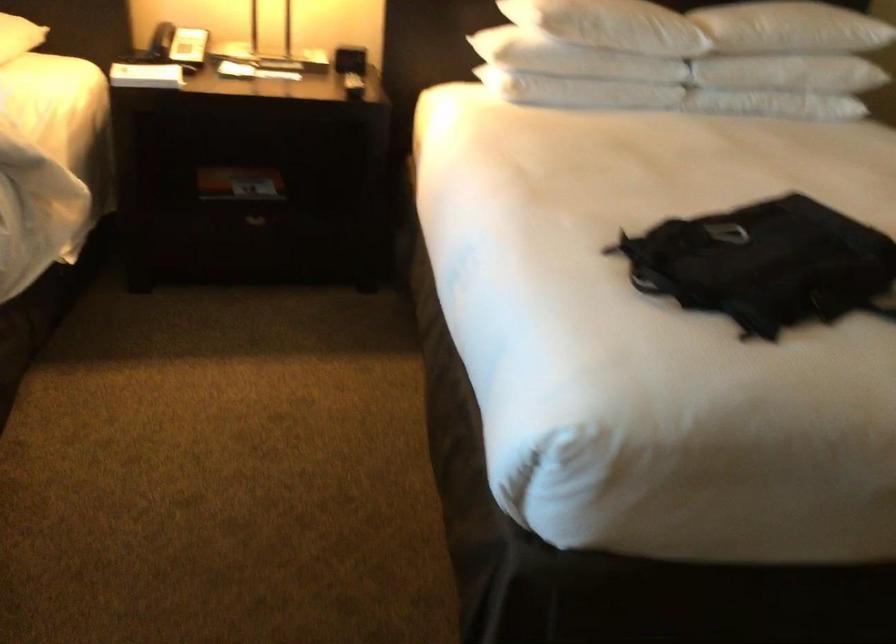
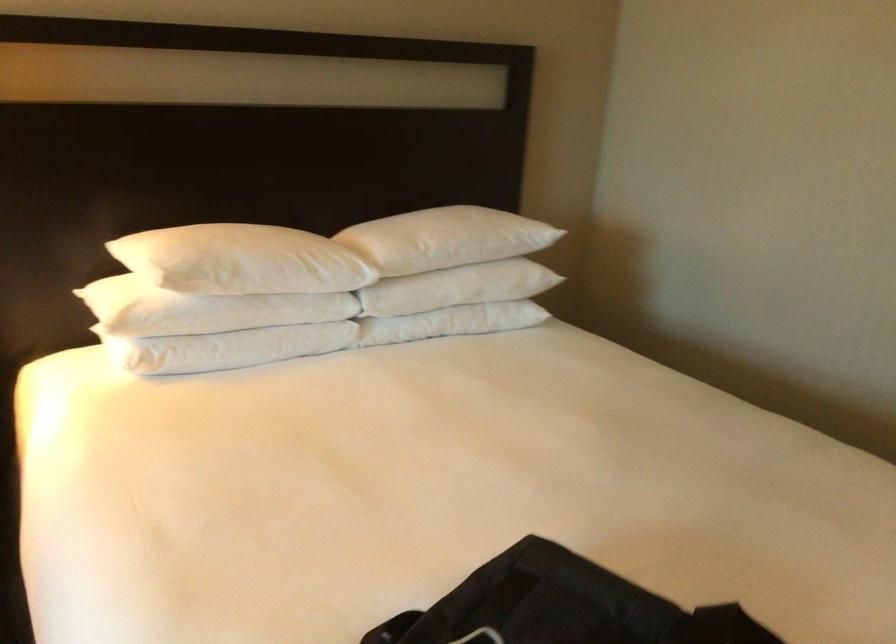
Question: Which direction would the cameraman need to move to produce the second image? Reply with the corresponding letter.

Choices:
 (A) Left
 (B) Right
 (C) Forward
 (D) Backward

Answer: (C)